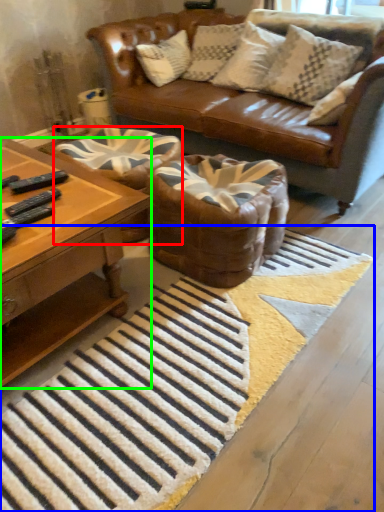
Question: Which object is positioned closest to swivel chair (highlighted by a red box)? Select from doormat (highlighted by a blue box) and coffee table (highlighted by a green box).

Choices:
 (A) doormat
 (B) coffee table

Answer: (B)